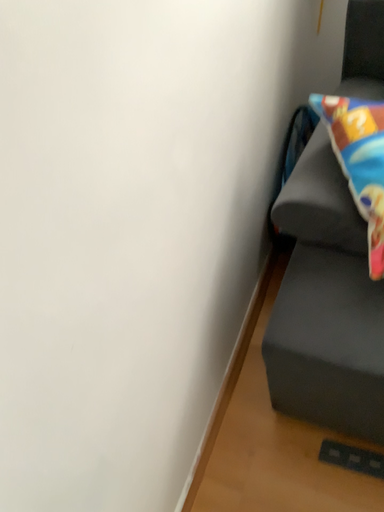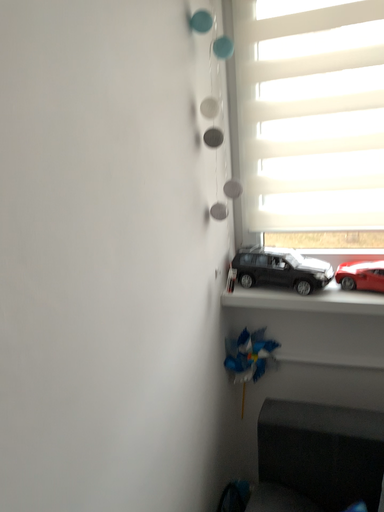
Question: How did the camera likely rotate when shooting the video?

Choices:
 (A) rotated downward
 (B) rotated upward

Answer: (B)